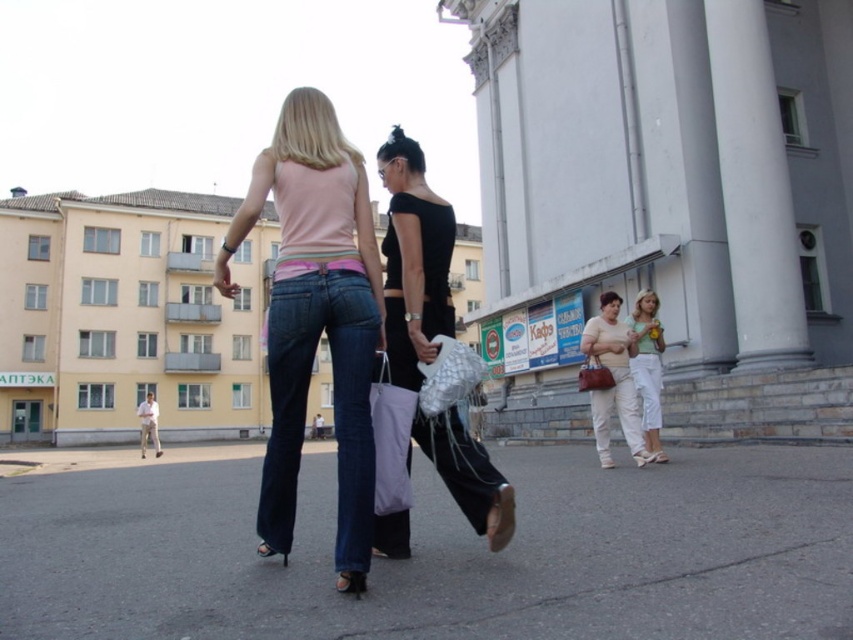
You are standing at the point marked by the coordinates point (332, 403) in the image. What is the material visible at this location?

The point (332, 403) indicates denim at center.

Looking at this image, you are standing at the center of the street and see the denim jeans at center and the matte beige pants at lower right. Which pair of pants is closer to you?

The denim jeans at center is closer to you because it is only 29.15 feet away from the matte beige pants at lower right, meaning the denim jeans at center is at the center while the matte beige pants at lower right are further away.